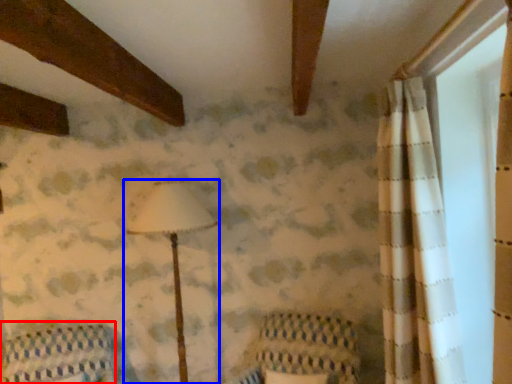
Question: Which point is further to the camera, furniture (highlighted by a red box) or lamp (highlighted by a blue box)?

Choices:
 (A) furniture
 (B) lamp

Answer: (B)